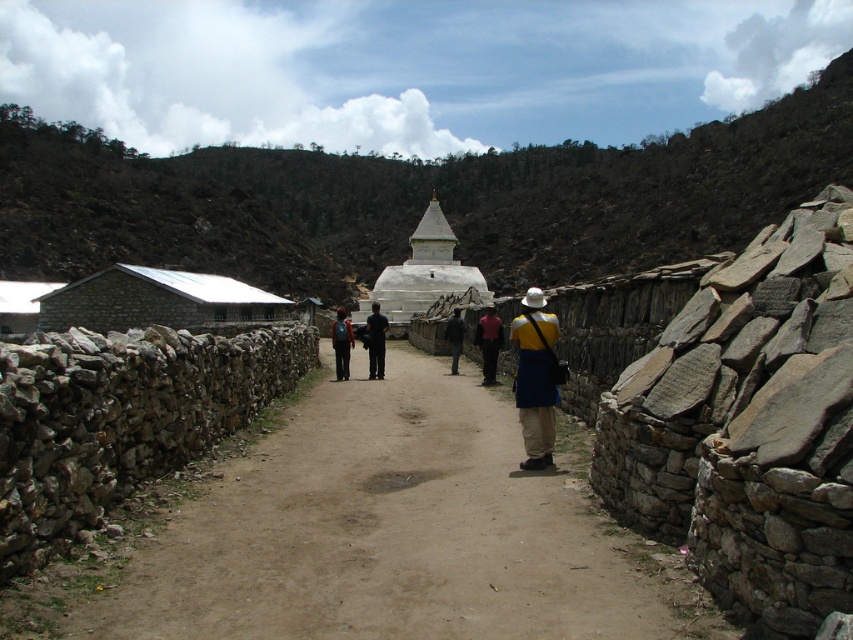
You are a hiker carrying both the black fabric backpack at center and the dark blue fabric at center. You need to pass through a narrow gap between two stone walls. Which item will you need to adjust first to ensure it fits through the gap?

The black fabric backpack at center has a larger width than the dark blue fabric at center, so you will need to adjust the black fabric backpack at center first to ensure it fits through the narrow gap between the two stone walls.

You are standing at the pagoda and want to walk towards the camera. Which point, point (483, 353) or point (463, 328), should you step on first?

You should step on point (483, 353) first because it is closer to the camera than point (463, 328).